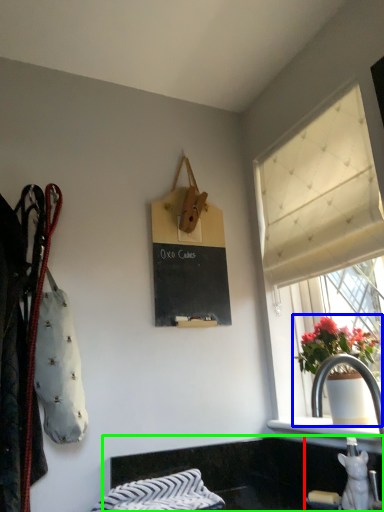
Question: Estimate the real-world distances between objects in this image. Which object is closer to sink (highlighted by a red box), houseplant (highlighted by a blue box) or counter top (highlighted by a green box)?

Choices:
 (A) houseplant
 (B) counter top

Answer: (B)